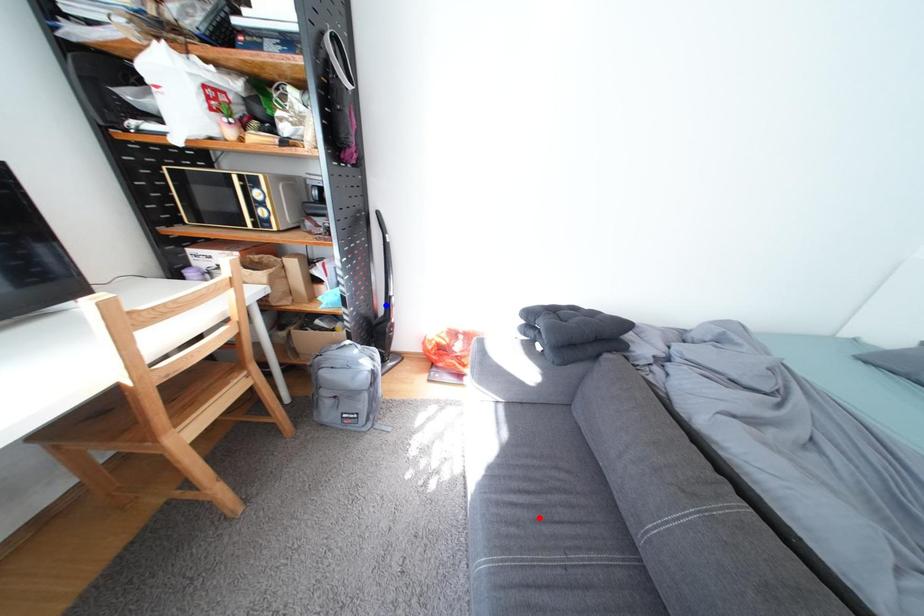
Question: Which of the two points in the image is closer to the camera?

Choices:
 (A) Blue point is closer.
 (B) Red point is closer.

Answer: (B)